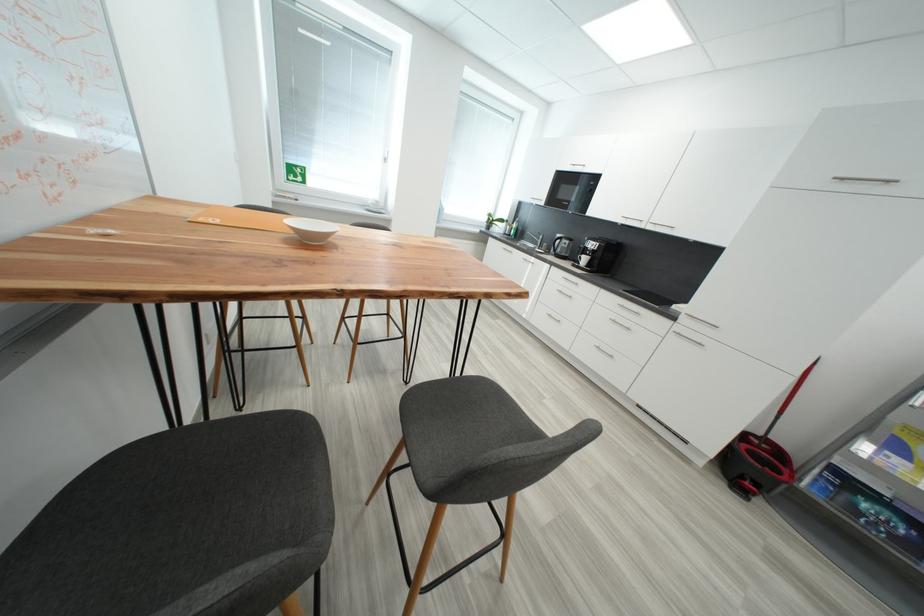
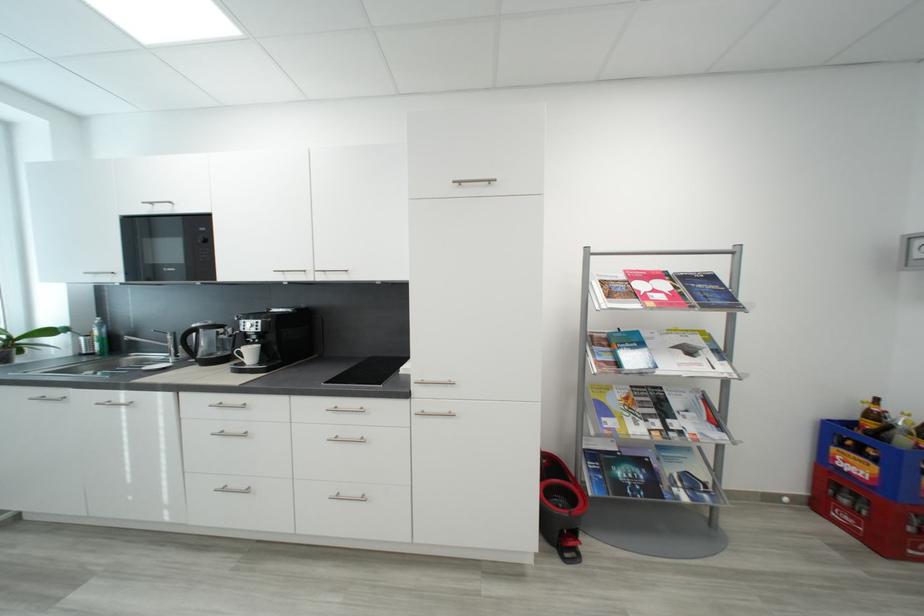
In the second image, find the point that corresponds to point (591, 261) in the first image.

(257, 354)